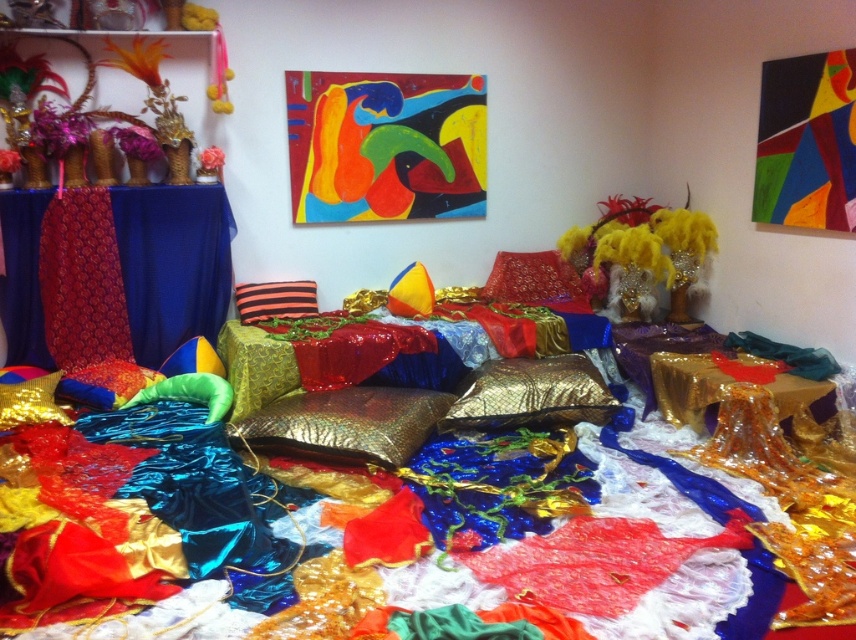
Question: Among these objects, which one is nearest to the camera?

Choices:
 (A) abstract painting at upper center
 (B) shiny red fabric pillow at center
 (C) striped fabric pillow at center

Answer: (C)

Question: Which object appears closest to the camera in this image?

Choices:
 (A) shiny red fabric pillow at center
 (B) abstract painting at upper center
 (C) striped fabric pillow at center

Answer: (C)

Question: Does gold sequined pillow at center appear on the right side of shiny red fabric pillow at center?

Choices:
 (A) no
 (B) yes

Answer: (A)

Question: Among these objects, which one is farthest from the camera?

Choices:
 (A) shiny red fabric pillow at center
 (B) striped fabric pillow at center

Answer: (A)

Question: Is abstract painting at upper center bigger than shiny red fabric pillow at center?

Choices:
 (A) yes
 (B) no

Answer: (A)

Question: Is abstract painting at upper center bigger than striped fabric pillow at center?

Choices:
 (A) yes
 (B) no

Answer: (A)